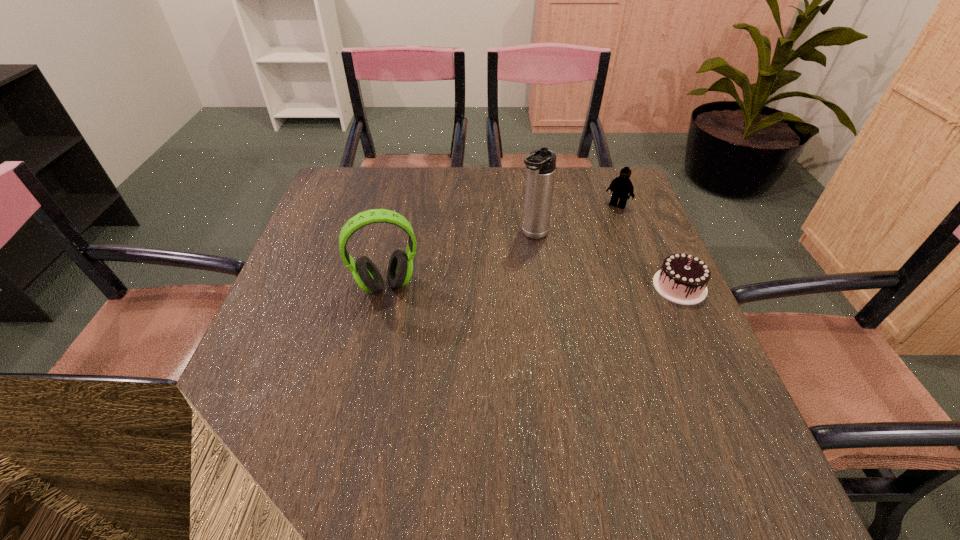
Identify the location of blank space at the far edge of the desktop. (487, 169).

At what (x,y) coordinates should I click in order to perform the action: click on blank space at the near edge. Please return your answer as a coordinate pair (x, y). This screenshot has height=540, width=960. Looking at the image, I should click on (531, 438).

You are a GUI agent. You are given a task and a screenshot of the screen. Output one action in this format:
    pyautogui.click(x=<x>, y=<y>)
    Task: Click on the free space at the left edge
    
    Given the screenshot: What is the action you would take?
    pyautogui.click(x=302, y=325)

In the image, there is a desktop. Identify the location of free region at the right edge. (624, 313).

The height and width of the screenshot is (540, 960). In the image, there is a desktop. What are the coordinates of `free space at the near left corner` in the screenshot? It's located at (291, 398).

The width and height of the screenshot is (960, 540). Identify the location of blank space at the far right corner of the desktop. coord(597,185).

At what (x,y) coordinates should I click in order to perform the action: click on empty space between the second shortest object and the chocolate cake. Please return your answer as a coordinate pair (x, y). This screenshot has height=540, width=960. Looking at the image, I should click on (649, 246).

This screenshot has width=960, height=540. What are the coordinates of `vacant space that is in between the second tallest object and the second shortest object` in the screenshot? It's located at (502, 245).

The image size is (960, 540). Find the location of `free space between the thermos bottle and the headset`. free space between the thermos bottle and the headset is located at coordinates (460, 260).

Find the location of a particular element. The width and height of the screenshot is (960, 540). free spot between the thermos bottle and the headset is located at coordinates (460, 260).